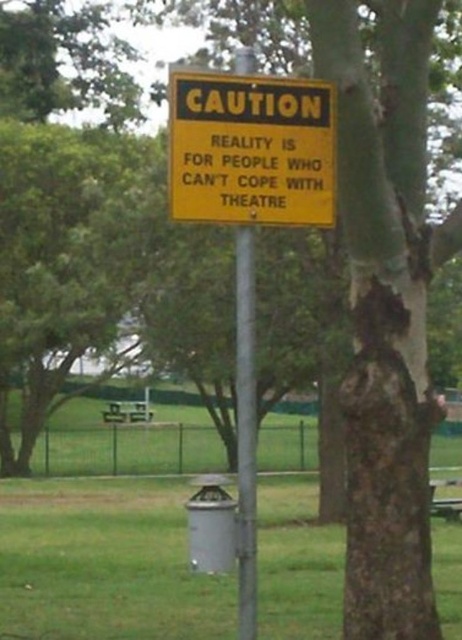
Which is above, yellow paper sign at center or green plastic picnic table at lower right?

yellow paper sign at center is higher up.

Does yellow paper sign at center have a larger size compared to green plastic picnic table at lower right?

No, yellow paper sign at center is not bigger than green plastic picnic table at lower right.

The image size is (462, 640). Describe the element at coordinates (250, 148) in the screenshot. I see `yellow paper sign at center` at that location.

Find the location of a particular element. This screenshot has height=640, width=462. yellow paper sign at center is located at coordinates point(250,148).

Image resolution: width=462 pixels, height=640 pixels. Describe the element at coordinates (245, 433) in the screenshot. I see `metallic pole at center` at that location.

Which is in front, point (255, 433) or point (456, 467)?

Point (255, 433) is in front.

Describe the element at coordinates (245, 433) in the screenshot. I see `metallic pole at center` at that location.

Where is `metallic pole at center`? This screenshot has width=462, height=640. metallic pole at center is located at coordinates (245, 433).

Consider the image. Between yellow paper sign at center and metallic pole at center, which one is positioned lower?

metallic pole at center is lower down.

Is yellow paper sign at center closer to the viewer compared to metallic pole at center?

No, yellow paper sign at center is further to the viewer.

Find the location of `yellow paper sign at center`. yellow paper sign at center is located at coordinates 250,148.